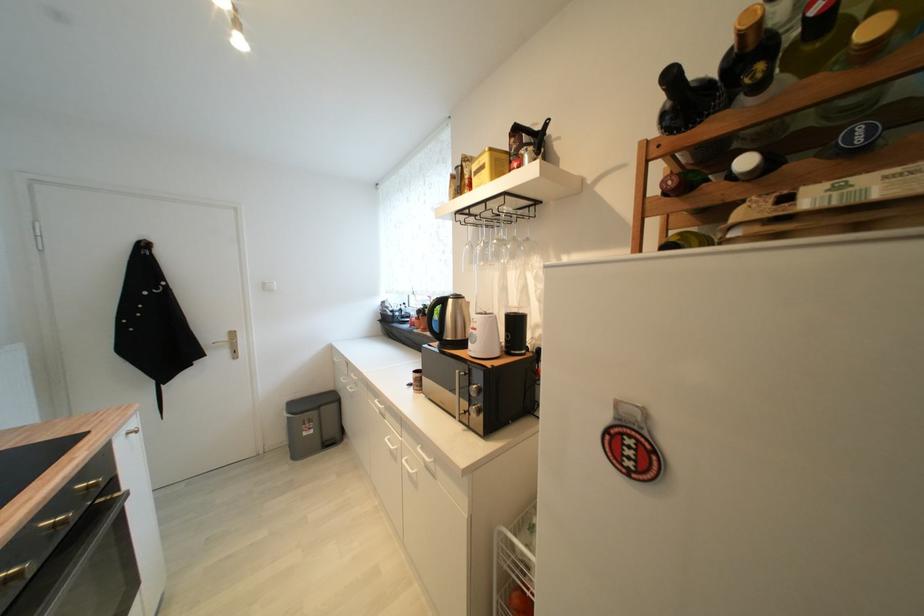
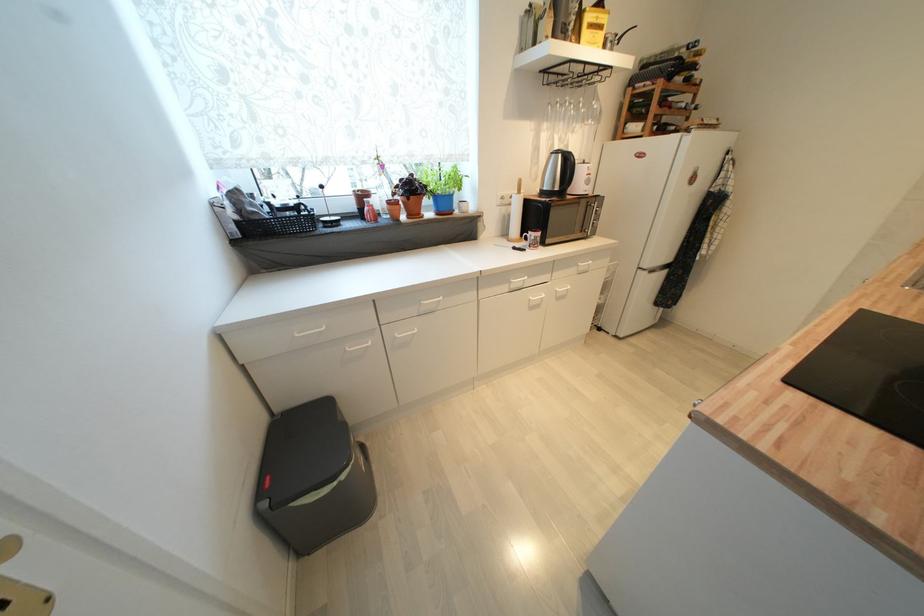
Locate, in the second image, the point that corresponds to point (483, 169) in the first image.

(600, 23)